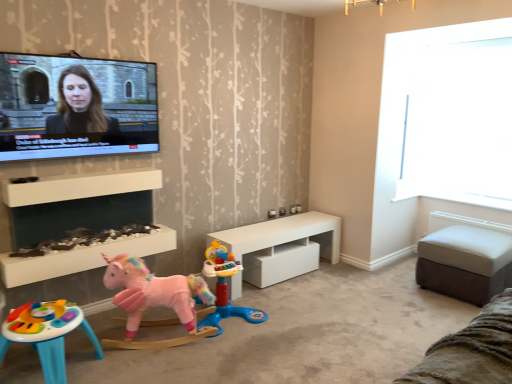
Locate an element on the screen. free spot above white matte shelf at center, arranged as the 2th shelf when ordered from the bottom (from a real-world perspective) is located at coordinates (100, 171).